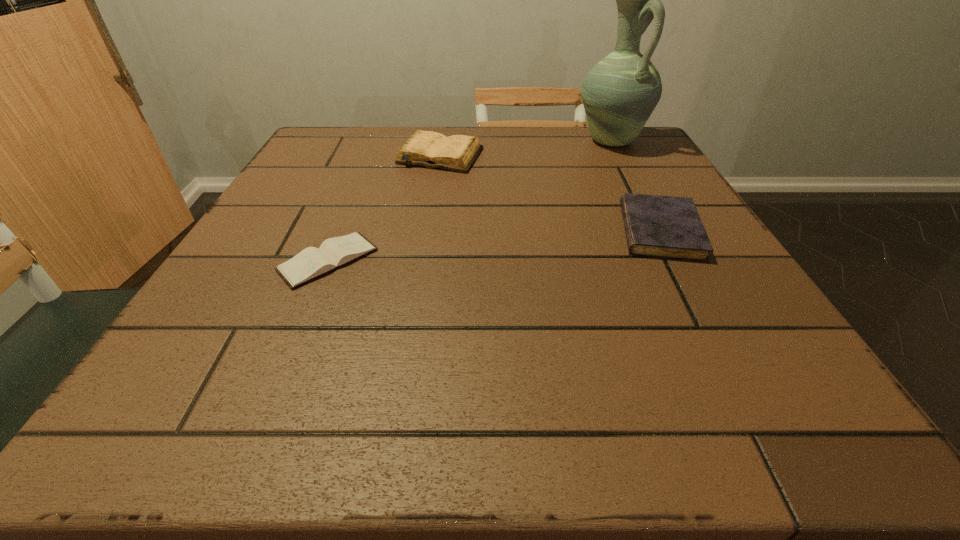
Locate an element on the screen. Image resolution: width=960 pixels, height=540 pixels. pitcher that is at the far edge is located at coordinates (619, 93).

I want to click on diary located in the far edge section of the desktop, so (458, 153).

I want to click on object at the left edge, so click(x=310, y=263).

The image size is (960, 540). Identify the location of pitcher that is positioned at the right edge. (619, 93).

Find the location of a particular element. This screenshot has width=960, height=540. diary that is positioned at the right edge is located at coordinates (667, 227).

The image size is (960, 540). I want to click on object present at the far right corner, so click(619, 93).

Locate an element on the screen. free space at the far edge of the desktop is located at coordinates (547, 127).

Locate an element on the screen. vacant point at the near edge is located at coordinates (348, 385).

In the image, there is a desktop. Identify the location of vacant space at the left edge. This screenshot has width=960, height=540. (302, 174).

In the image, there is a desktop. At what (x,y) coordinates should I click in order to perform the action: click on free space at the right edge. Please return your answer as a coordinate pair (x, y). The height and width of the screenshot is (540, 960). Looking at the image, I should click on coord(742,300).